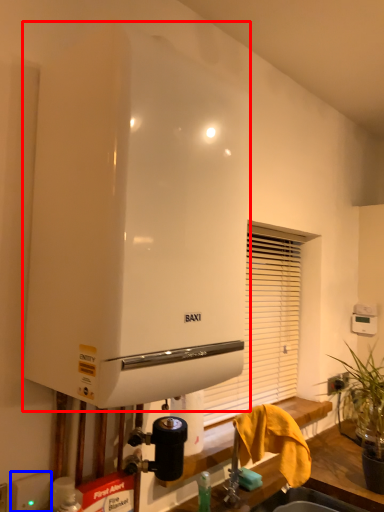
Question: Among these objects, which one is farthest to the camera, water heater (highlighted by a red box) or electric outlet (highlighted by a blue box)?

Choices:
 (A) water heater
 (B) electric outlet

Answer: (B)